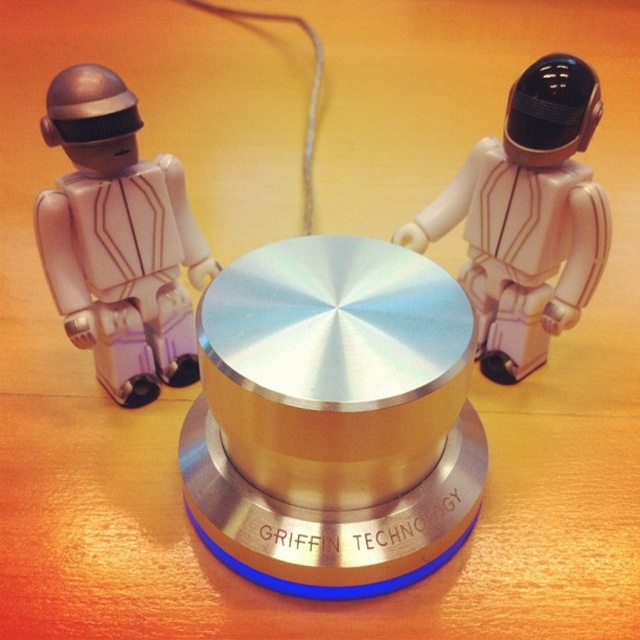
You are standing at the point labeled point (81, 84) and want to take a photo of the astronauts and the cylinder. If your camera is 38.10 inches away from the point, will the entire scene be in frame?

Since the camera is exactly 38.10 inches away from point (81, 84), and the entire scene is centered around this point, the camera should capture the entire scene in frame.

You are a technician who needs to adjust the satin silver knob at center. You are currently standing next to the matte white robot at left. Can you reach the knob without moving your position?

The satin silver knob at center and the matte white robot at left are 11.53 inches apart. If the technician can reach 12 inches or more, they can adjust the knob without moving. Otherwise, they need to step closer.